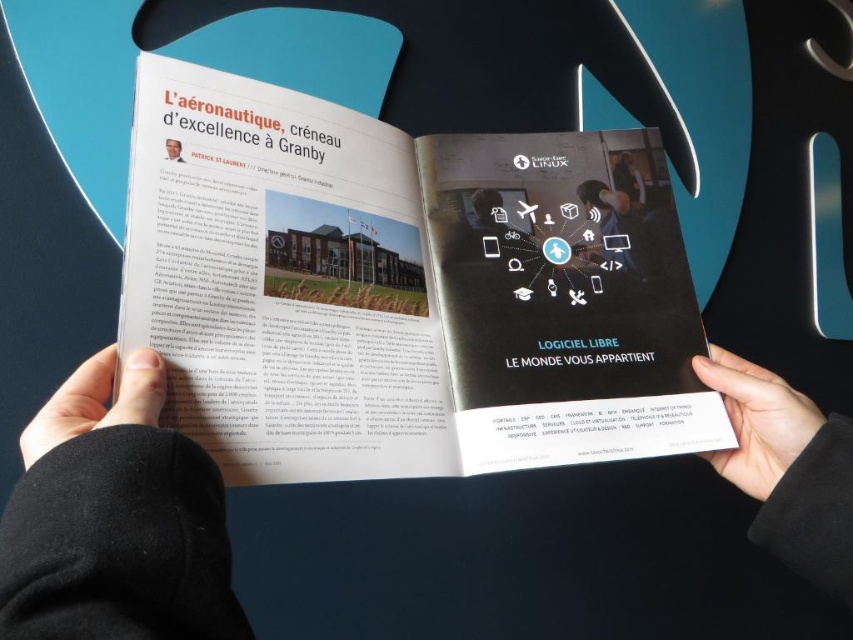
Can you confirm if white paper at lower right is smaller than smooth skin face at upper left?

Actually, white paper at lower right might be larger than smooth skin face at upper left.

Identify the location of white paper at lower right. (756, 420).

Is black fabric hands at center further to camera compared to white matte paper at lower left?

No, it is in front of white matte paper at lower left.

Is point (828, 564) positioned behind point (144, 358)?

Yes.

The width and height of the screenshot is (853, 640). What are the coordinates of `black fabric hands at center` in the screenshot? It's located at (115, 518).

Is point (735, 484) farther from viewer compared to point (86, 388)?

Yes, point (735, 484) is farther from viewer.

Is white paper at lower right thinner than white matte paper at lower left?

No.

This screenshot has height=640, width=853. I want to click on white paper at lower right, so click(756, 420).